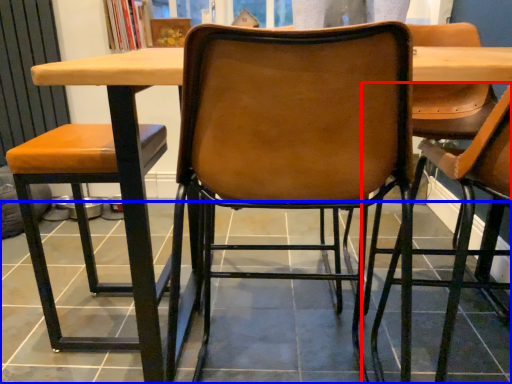
Question: Among these objects, which one is nearest to the camera, chair (highlighted by a red box) or tile (highlighted by a blue box)?

Choices:
 (A) chair
 (B) tile

Answer: (A)